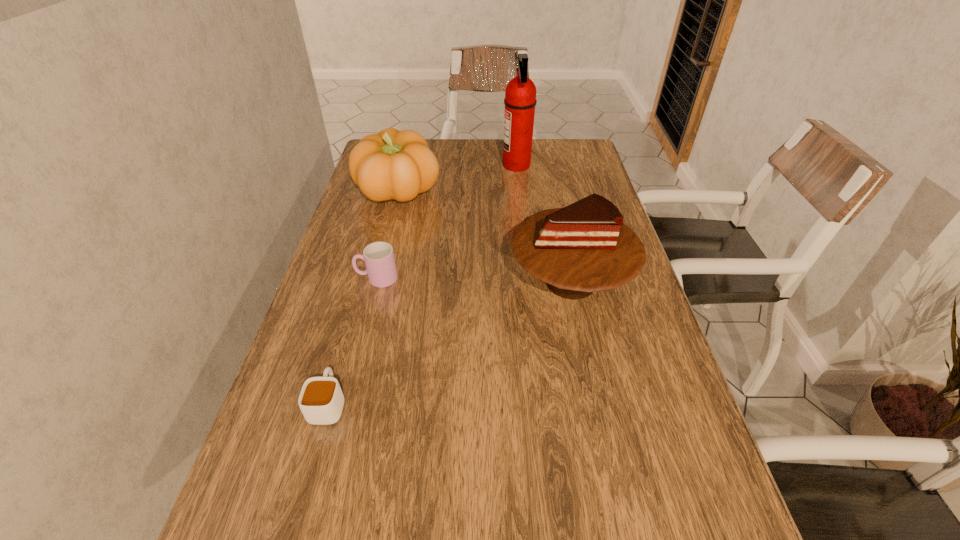
This screenshot has height=540, width=960. Identify the location of object present at the far left corner. (393, 164).

I want to click on vacant region at the far edge, so click(429, 146).

In the image, there is a desktop. Where is `vacant space at the right edge`? vacant space at the right edge is located at coordinates (610, 292).

You are a GUI agent. You are given a task and a screenshot of the screen. Output one action in this format:
    pyautogui.click(x=<x>, y=<y>)
    Task: Click on the blank area at the far right corner
    This screenshot has width=960, height=540.
    Given the screenshot: What is the action you would take?
    pyautogui.click(x=574, y=158)

This screenshot has height=540, width=960. In order to click on vacant point located between the fourth tallest object and the pumpkin in this screenshot , I will do `click(388, 235)`.

Where is `empty space between the nearest object and the taller cup`? empty space between the nearest object and the taller cup is located at coordinates (352, 341).

I want to click on blank region between the cake and the taller cup, so tap(473, 280).

The image size is (960, 540). Find the location of `vacant space that is in between the cake and the farther cup`. vacant space that is in between the cake and the farther cup is located at coordinates (473, 280).

Find the location of a particular element. vacant area between the pumpkin and the tallest object is located at coordinates (458, 179).

The width and height of the screenshot is (960, 540). In order to click on vacant space in between the cake and the pumpkin in this screenshot , I will do `click(485, 237)`.